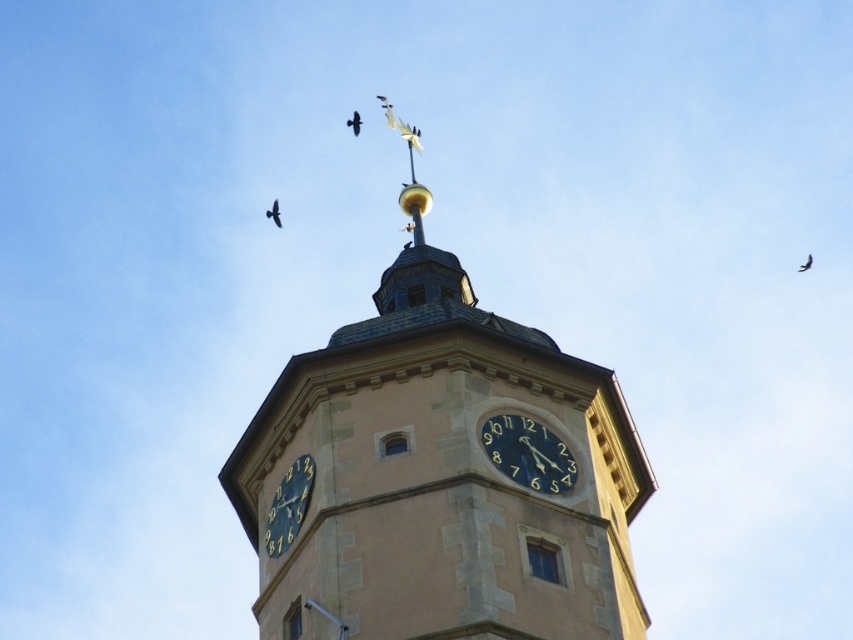
Consider the image. You are an architect designing a new clock tower. You want to ensure that the dark blue clock face at lower left and the dark brown feathered bird at upper center are visible from the ground. Considering their heights, which one will appear smaller to someone standing at the base of the tower?

The dark blue clock face at lower left is not as tall as the dark brown feathered bird at upper center, so it will appear smaller to someone standing at the base of the tower.

You are standing directly in front of the clock tower. There is a dark brown feathered bird at upper center represented by point [354,122]. Where would you look to see the bird?

The dark brown feathered bird at upper center is located at point [354,122], which is at the upper center of the clock tower. Look upward towards the top middle section of the tower to see the bird.

You are a birdwatcher observing the clock tower. You notice two birds perched on the clock tower. The brown feathered bird at upper left and the black feathered bird at upper right. Which bird has a larger width?

The brown feathered bird at upper left has a larger width than the black feathered bird at upper right.